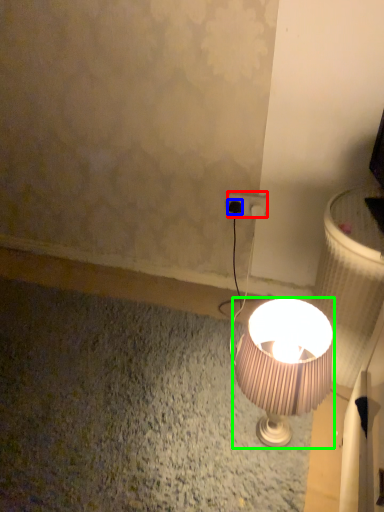
Question: Which object is positioned farthest from power plugs and sockets (highlighted by a red box)? Select from plug (highlighted by a blue box) and lamp (highlighted by a green box).

Choices:
 (A) plug
 (B) lamp

Answer: (B)